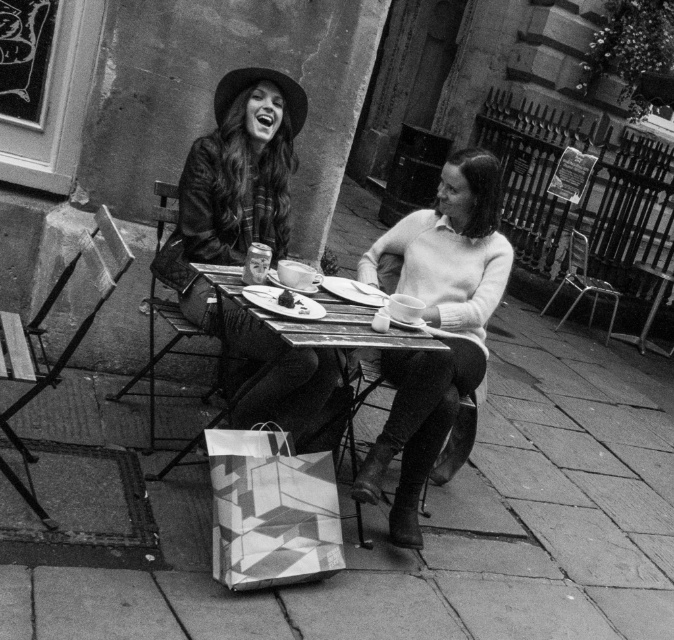
Question: From the image, what is the correct spatial relationship of knitted sweater at center in relation to leather jacket at center?

Choices:
 (A) left
 (B) right

Answer: (B)

Question: Can you confirm if knitted sweater at center is positioned below geometric-patterned paper bag at lower center?

Choices:
 (A) no
 (B) yes

Answer: (A)

Question: Is knitted sweater at center in front of leather jacket at center?

Choices:
 (A) no
 (B) yes

Answer: (A)

Question: Which point is closer to the camera?

Choices:
 (A) leather jacket at center
 (B) geometric-patterned paper bag at lower center
 (C) wooden table at center
 (D) knitted sweater at center

Answer: (C)

Question: Which point is closer to the camera?

Choices:
 (A) (251, 452)
 (B) (392, 280)

Answer: (A)

Question: Considering the real-world distances, which object is farthest from the wooden table at center?

Choices:
 (A) leather jacket at center
 (B) geometric-patterned paper bag at lower center

Answer: (B)